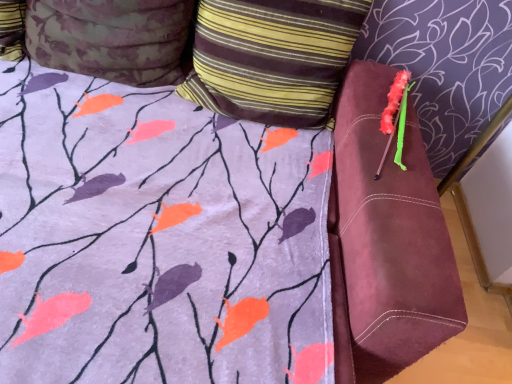
Image resolution: width=512 pixels, height=384 pixels. What do you see at coordinates (394, 101) in the screenshot?
I see `fluffy pink brush at upper right` at bounding box center [394, 101].

This screenshot has width=512, height=384. In order to click on fluffy pink brush at upper right in this screenshot , I will do `click(394, 101)`.

Identify the location of striped fabric pillow at upper center, arranged as the second pillow when viewed from the left. 272,58.

Where is `floral fabric pillow at upper left, which is the second pillow in right-to-left order`? floral fabric pillow at upper left, which is the second pillow in right-to-left order is located at coordinates (111, 38).

This screenshot has width=512, height=384. What are the coordinates of `fluffy pink brush at upper right` in the screenshot? It's located at (394, 101).

Is point (388, 95) closer to viewer compared to point (126, 45)?

No, it is behind (126, 45).

Between fluffy pink brush at upper right and floral fabric pillow at upper left, arranged as the 1th pillow when viewed from the left, which one has smaller width?

Thinner between the two is floral fabric pillow at upper left, arranged as the 1th pillow when viewed from the left.

Looking at this image, is fluffy pink brush at upper right positioned with its back to floral fabric pillow at upper left, which is the second pillow in right-to-left order?

No.

Is fluffy pink brush at upper right taller or shorter than striped fabric pillow at upper center, arranged as the second pillow when viewed from the left?

Clearly, fluffy pink brush at upper right is shorter compared to striped fabric pillow at upper center, arranged as the second pillow when viewed from the left.

Considering the sizes of fluffy pink brush at upper right and striped fabric pillow at upper center, marked as the first pillow in a right-to-left arrangement, in the image, is fluffy pink brush at upper right wider or thinner than striped fabric pillow at upper center, marked as the first pillow in a right-to-left arrangement,?

Clearly, fluffy pink brush at upper right has more width compared to striped fabric pillow at upper center, marked as the first pillow in a right-to-left arrangement.

Is fluffy pink brush at upper right far from striped fabric pillow at upper center, marked as the first pillow in a right-to-left arrangement?

They are positioned close to each other.

Which object is closer to the camera, striped fabric pillow at upper center, marked as the first pillow in a right-to-left arrangement, or floral fabric pillow at upper left, arranged as the 1th pillow when viewed from the left?

floral fabric pillow at upper left, arranged as the 1th pillow when viewed from the left, is closer to the camera.

From the image's perspective, is striped fabric pillow at upper center, marked as the first pillow in a right-to-left arrangement, on top of floral fabric pillow at upper left, arranged as the 1th pillow when viewed from the left?

Incorrect, from the image's perspective, striped fabric pillow at upper center, marked as the first pillow in a right-to-left arrangement, is lower than floral fabric pillow at upper left, arranged as the 1th pillow when viewed from the left.

Does striped fabric pillow at upper center, arranged as the second pillow when viewed from the left, have a smaller size compared to floral fabric pillow at upper left, which is the second pillow in right-to-left order?

No, striped fabric pillow at upper center, arranged as the second pillow when viewed from the left, is not smaller than floral fabric pillow at upper left, which is the second pillow in right-to-left order.

How many degrees apart are the facing directions of striped fabric pillow at upper center, marked as the first pillow in a right-to-left arrangement, and floral fabric pillow at upper left, which is the second pillow in right-to-left order?

striped fabric pillow at upper center, marked as the first pillow in a right-to-left arrangement, and floral fabric pillow at upper left, which is the second pillow in right-to-left order, are facing 0.00017 degrees away from each other.

What's the angular difference between floral fabric pillow at upper left, arranged as the 1th pillow when viewed from the left, and striped fabric pillow at upper center, arranged as the second pillow when viewed from the left,'s facing directions?

0.00017 degrees.

Considering the relative positions of floral fabric pillow at upper left, arranged as the 1th pillow when viewed from the left, and striped fabric pillow at upper center, marked as the first pillow in a right-to-left arrangement, in the image provided, is floral fabric pillow at upper left, arranged as the 1th pillow when viewed from the left, in front of striped fabric pillow at upper center, marked as the first pillow in a right-to-left arrangement,?

That is True.

Considering the sizes of objects floral fabric pillow at upper left, which is the second pillow in right-to-left order, and striped fabric pillow at upper center, arranged as the second pillow when viewed from the left, in the image provided, who is wider, floral fabric pillow at upper left, which is the second pillow in right-to-left order, or striped fabric pillow at upper center, arranged as the second pillow when viewed from the left,?

floral fabric pillow at upper left, which is the second pillow in right-to-left order, is wider.

Based on their sizes in the image, would you say floral fabric pillow at upper left, arranged as the 1th pillow when viewed from the left, is bigger or smaller than striped fabric pillow at upper center, arranged as the second pillow when viewed from the left?

Clearly, floral fabric pillow at upper left, arranged as the 1th pillow when viewed from the left, is smaller in size than striped fabric pillow at upper center, arranged as the second pillow when viewed from the left.

From a real-world perspective, is floral fabric pillow at upper left, arranged as the 1th pillow when viewed from the left, over fluffy pink brush at upper right?

Correct, in the physical world, floral fabric pillow at upper left, arranged as the 1th pillow when viewed from the left, is higher than fluffy pink brush at upper right.

How distant is floral fabric pillow at upper left, arranged as the 1th pillow when viewed from the left, from fluffy pink brush at upper right?

A distance of 87.35 centimeters exists between floral fabric pillow at upper left, arranged as the 1th pillow when viewed from the left, and fluffy pink brush at upper right.

From the image's perspective, relative to fluffy pink brush at upper right, is floral fabric pillow at upper left, which is the second pillow in right-to-left order, above or below?

Based on their image positions, floral fabric pillow at upper left, which is the second pillow in right-to-left order, is located above fluffy pink brush at upper right.

Where is `flower below the striped fabric pillow at upper center, arranged as the second pillow when viewed from the left (from the image's perspective)`? The image size is (512, 384). flower below the striped fabric pillow at upper center, arranged as the second pillow when viewed from the left (from the image's perspective) is located at coordinates (394, 101).

From the image's perspective, relative to fluffy pink brush at upper right, is striped fabric pillow at upper center, marked as the first pillow in a right-to-left arrangement, above or below?

Based on their image positions, striped fabric pillow at upper center, marked as the first pillow in a right-to-left arrangement, is located above fluffy pink brush at upper right.

From a real-world perspective, is striped fabric pillow at upper center, arranged as the second pillow when viewed from the left, physically located above or below fluffy pink brush at upper right?

striped fabric pillow at upper center, arranged as the second pillow when viewed from the left, is situated higher than fluffy pink brush at upper right in the real world.

Can we say striped fabric pillow at upper center, marked as the first pillow in a right-to-left arrangement, lies outside fluffy pink brush at upper right?

Yes, striped fabric pillow at upper center, marked as the first pillow in a right-to-left arrangement, is outside of fluffy pink brush at upper right.

I want to click on pillow that is the 2nd object located above the fluffy pink brush at upper right (from the image's perspective), so click(x=111, y=38).

Where is `the 1st pillow counting from the left side of the fluffy pink brush at upper right`? This screenshot has height=384, width=512. the 1st pillow counting from the left side of the fluffy pink brush at upper right is located at coordinates (272, 58).

From the image, which object appears to be nearer to fluffy pink brush at upper right, striped fabric pillow at upper center, arranged as the second pillow when viewed from the left, or floral fabric pillow at upper left, arranged as the 1th pillow when viewed from the left?

striped fabric pillow at upper center, arranged as the second pillow when viewed from the left, lies closer to fluffy pink brush at upper right than the other object.

From the image, which object appears to be nearer to floral fabric pillow at upper left, arranged as the 1th pillow when viewed from the left, striped fabric pillow at upper center, marked as the first pillow in a right-to-left arrangement, or fluffy pink brush at upper right?

Based on the image, striped fabric pillow at upper center, marked as the first pillow in a right-to-left arrangement, appears to be nearer to floral fabric pillow at upper left, arranged as the 1th pillow when viewed from the left.

Which object lies further to the anchor point striped fabric pillow at upper center, arranged as the second pillow when viewed from the left, fluffy pink brush at upper right or floral fabric pillow at upper left, arranged as the 1th pillow when viewed from the left?

fluffy pink brush at upper right.

Looking at the image, which one is located closer to fluffy pink brush at upper right, floral fabric pillow at upper left, arranged as the 1th pillow when viewed from the left, or striped fabric pillow at upper center, arranged as the second pillow when viewed from the left?

striped fabric pillow at upper center, arranged as the second pillow when viewed from the left, is closer to fluffy pink brush at upper right.

Looking at the image, which one is located further to floral fabric pillow at upper left, which is the second pillow in right-to-left order, fluffy pink brush at upper right or striped fabric pillow at upper center, marked as the first pillow in a right-to-left arrangement?

fluffy pink brush at upper right lies further to floral fabric pillow at upper left, which is the second pillow in right-to-left order, than the other object.

Estimate the real-world distances between objects in this image. Which object is further from striped fabric pillow at upper center, arranged as the second pillow when viewed from the left, floral fabric pillow at upper left, which is the second pillow in right-to-left order, or fluffy pink brush at upper right?

fluffy pink brush at upper right lies further to striped fabric pillow at upper center, arranged as the second pillow when viewed from the left, than the other object.

At what (x,y) coordinates should I click in order to perform the action: click on pillow between floral fabric pillow at upper left, which is the second pillow in right-to-left order, and fluffy pink brush at upper right from left to right. Please return your answer as a coordinate pair (x, y). Looking at the image, I should click on (272, 58).